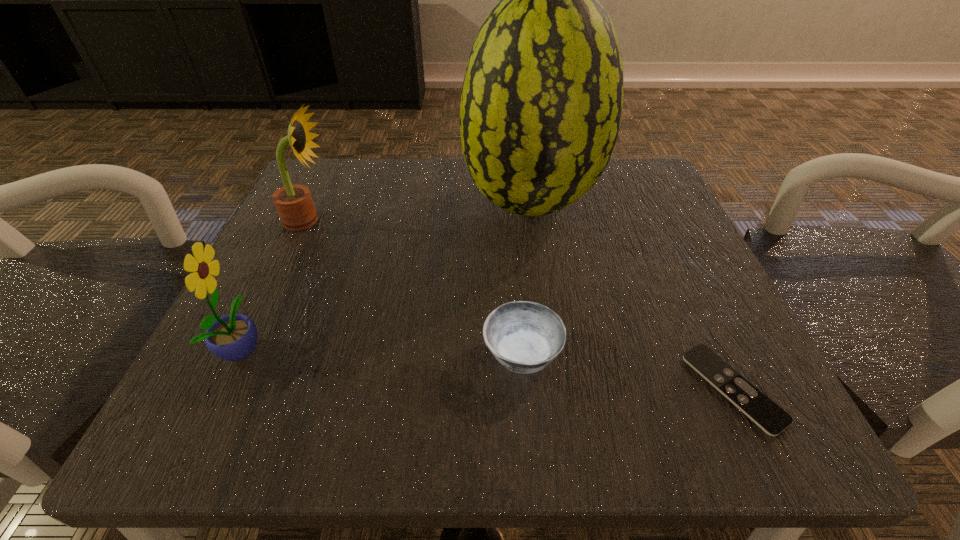
Find the location of a particular element. object that is at the far right corner is located at coordinates (541, 104).

Find the location of `object positioned at the near right corner`. object positioned at the near right corner is located at coordinates (772, 419).

You are a GUI agent. You are given a task and a screenshot of the screen. Output one action in this format:
    pyautogui.click(x=<x>, y=<y>)
    Task: Click on the blank area at the far edge
    
    Given the screenshot: What is the action you would take?
    pyautogui.click(x=407, y=222)

Locate an element on the screen. This screenshot has height=540, width=960. vacant position at the near edge of the desktop is located at coordinates (436, 385).

In the image, there is a desktop. What are the coordinates of `free space at the left edge` in the screenshot? It's located at (335, 292).

Where is `free space at the right edge of the desktop`? The image size is (960, 540). free space at the right edge of the desktop is located at coordinates (729, 347).

Identify the location of vacant space at the far left corner of the desktop. The width and height of the screenshot is (960, 540). (320, 160).

Find the location of a particular element. This screenshot has width=960, height=540. free space at the near left corner of the desktop is located at coordinates (x=246, y=439).

In the image, there is a desktop. At what (x,y) coordinates should I click in order to perform the action: click on vacant space at the far right corner. Please return your answer as a coordinate pair (x, y). The height and width of the screenshot is (540, 960). Looking at the image, I should click on (640, 180).

Image resolution: width=960 pixels, height=540 pixels. In order to click on blank region between the watermelon and the farther sunflower in this screenshot , I will do `click(420, 213)`.